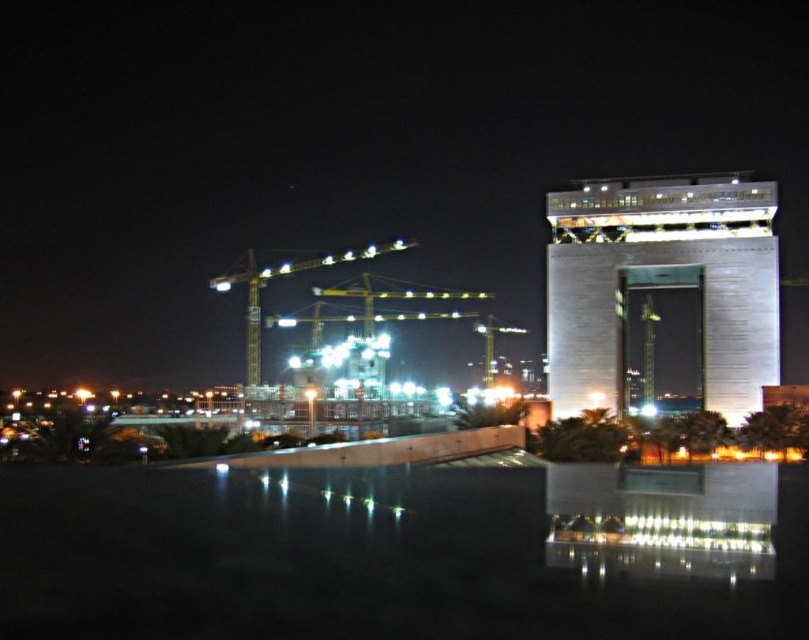
Who is taller, matte concrete construction site at center or yellow metallic crane at center?

yellow metallic crane at center is taller.

Measure the distance between matte concrete construction site at center and camera.

The distance of matte concrete construction site at center from camera is 45.08 meters.

Locate an element on the screen. matte concrete construction site at center is located at coordinates (404, 552).

Consider the image. Can you confirm if matte concrete construction site at center is taller than sleek gray building at upper right?

No, matte concrete construction site at center is not taller than sleek gray building at upper right.

Is matte concrete construction site at center below sleek gray building at upper right?

Yes, matte concrete construction site at center is below sleek gray building at upper right.

At what (x,y) coordinates should I click in order to perform the action: click on matte concrete construction site at center. Please return your answer as a coordinate pair (x, y). Looking at the image, I should click on (404, 552).

Can you confirm if sleek gray building at upper right is taller than yellow metallic crane at center?

Indeed, sleek gray building at upper right has a greater height compared to yellow metallic crane at center.

Is sleek gray building at upper right further to camera compared to yellow metallic crane at center?

That is False.

Image resolution: width=809 pixels, height=640 pixels. Describe the element at coordinates (663, 296) in the screenshot. I see `sleek gray building at upper right` at that location.

The height and width of the screenshot is (640, 809). What are the coordinates of `sleek gray building at upper right` in the screenshot? It's located at (663, 296).